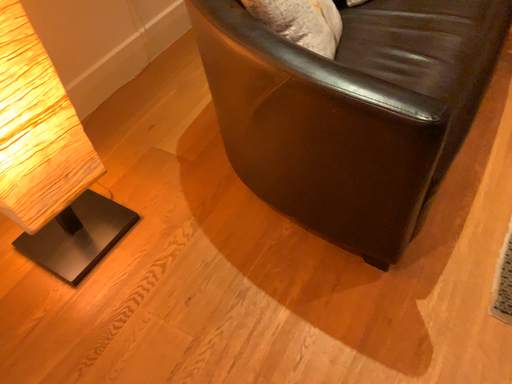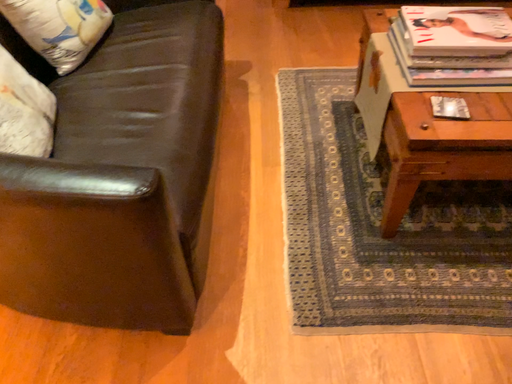
Question: How did the camera likely rotate when shooting the video?

Choices:
 (A) rotated downward
 (B) rotated upward

Answer: (B)